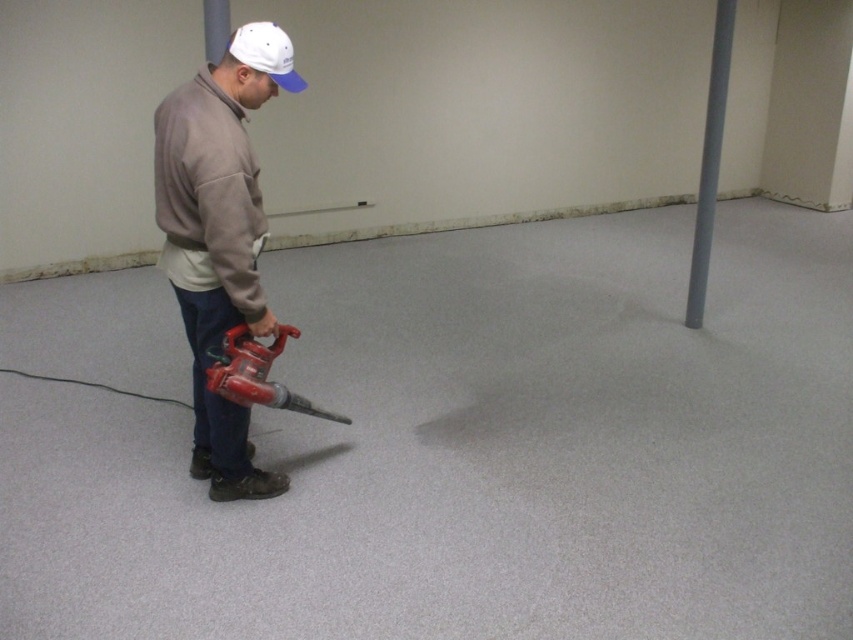
Question: Which object is the closest to the matte gray jacket at left?

Choices:
 (A) white fabric cap at upper center
 (B) red plastic leaf blower at lower left
 (C) gray carpet at center

Answer: (B)

Question: Which point appears farthest from the camera in this image?

Choices:
 (A) tap(225, 387)
 (B) tap(228, 268)

Answer: (A)

Question: Does red plastic leaf blower at lower left have a smaller size compared to white fabric cap at upper center?

Choices:
 (A) yes
 (B) no

Answer: (B)

Question: Can you confirm if matte gray jacket at left is positioned to the right of white fabric cap at upper center?

Choices:
 (A) no
 (B) yes

Answer: (A)

Question: Can you confirm if matte gray jacket at left is bigger than red plastic leaf blower at lower left?

Choices:
 (A) yes
 (B) no

Answer: (A)

Question: Among these points, which one is farthest from the camera?

Choices:
 (A) (247, 228)
 (B) (245, 358)
 (C) (276, 56)

Answer: (B)